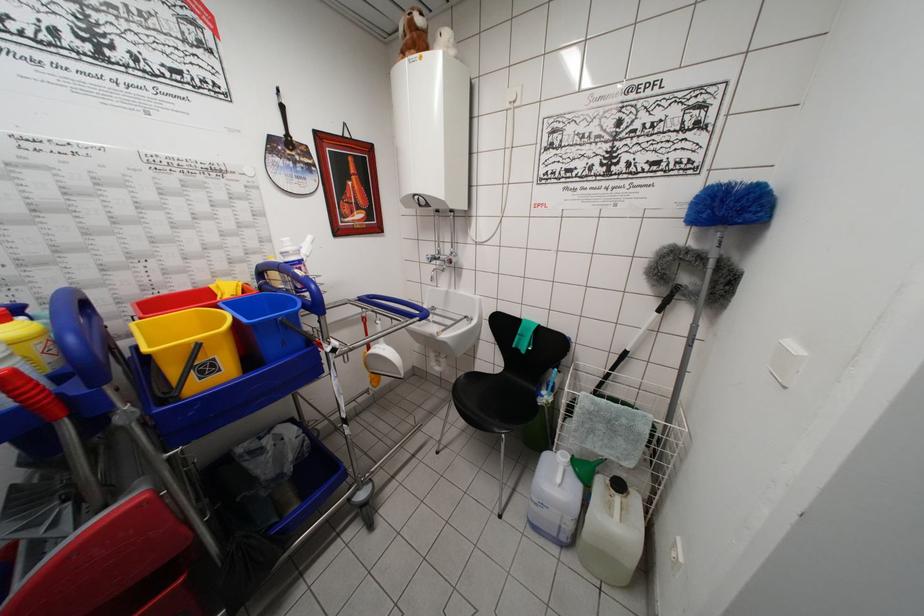
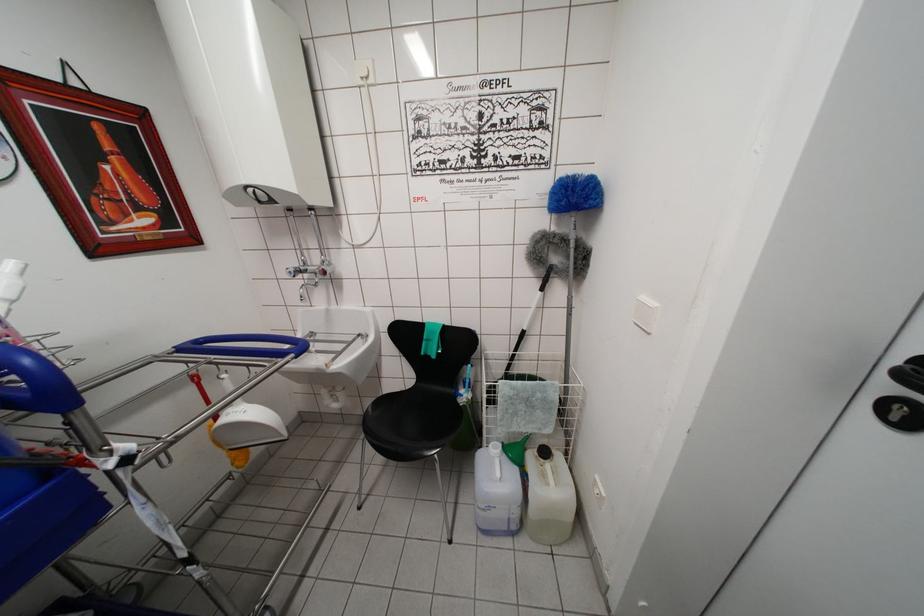
In the second image, find the point that corresponds to (436,276) in the first image.

(305, 292)